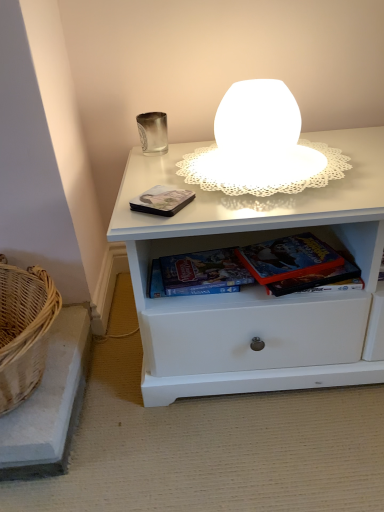
Question: Can you confirm if hardcover book at lower center, which ranks as the third paperback book in left-to-right order, is positioned to the right of white frosted glass table lamp at upper center?

Choices:
 (A) yes
 (B) no

Answer: (A)

Question: From the image's perspective, would you say hardcover book at lower center, acting as the 1th paperback book starting from the right, is positioned over white frosted glass table lamp at upper center?

Choices:
 (A) yes
 (B) no

Answer: (B)

Question: Is hardcover book at lower center, which ranks as the third paperback book in left-to-right order, facing towards white frosted glass table lamp at upper center?

Choices:
 (A) no
 (B) yes

Answer: (A)

Question: Is hardcover book at lower center, acting as the 1th paperback book starting from the right, bigger than white frosted glass table lamp at upper center?

Choices:
 (A) no
 (B) yes

Answer: (A)

Question: Considering the relative sizes of hardcover book at lower center, acting as the 1th paperback book starting from the right, and white frosted glass table lamp at upper center in the image provided, is hardcover book at lower center, acting as the 1th paperback book starting from the right, smaller than white frosted glass table lamp at upper center?

Choices:
 (A) no
 (B) yes

Answer: (B)

Question: Is point click(x=266, y=248) positioned closer to the camera than point click(x=157, y=186)?

Choices:
 (A) farther
 (B) closer

Answer: (A)

Question: From the image's perspective, is hardcover book at lower center, which ranks as the third paperback book in left-to-right order, positioned above or below metallic matte book at center, arranged as the first paperback book when viewed from the left?

Choices:
 (A) above
 (B) below

Answer: (B)

Question: Visually, is hardcover book at lower center, acting as the 1th paperback book starting from the right, positioned to the left or to the right of metallic matte book at center, the third paperback book in the right-to-left sequence?

Choices:
 (A) left
 (B) right

Answer: (B)

Question: Is hardcover book at lower center, which ranks as the third paperback book in left-to-right order, wider or thinner than metallic matte book at center, the third paperback book in the right-to-left sequence?

Choices:
 (A) wide
 (B) thin

Answer: (A)

Question: In the image, is hardcover book at lower center, which ranks as the third paperback book in left-to-right order, on the left side or the right side of woven wicker basket at lower left?

Choices:
 (A) right
 (B) left

Answer: (A)

Question: In terms of height, does hardcover book at lower center, acting as the 1th paperback book starting from the right, look taller or shorter compared to woven wicker basket at lower left?

Choices:
 (A) tall
 (B) short

Answer: (B)

Question: Considering the positions of point (324, 261) and point (67, 357), is point (324, 261) closer or farther from the camera than point (67, 357)?

Choices:
 (A) closer
 (B) farther

Answer: (A)

Question: From the image's perspective, relative to woven wicker basket at lower left, is hardcover book at lower center, acting as the 1th paperback book starting from the right, above or below?

Choices:
 (A) above
 (B) below

Answer: (A)

Question: Based on their sizes in the image, would you say white frosted glass table lamp at upper center is bigger or smaller than metallic matte book at center, arranged as the first paperback book when viewed from the left?

Choices:
 (A) small
 (B) big

Answer: (B)

Question: Considering the positions of white frosted glass table lamp at upper center and metallic matte book at center, arranged as the first paperback book when viewed from the left, in the image, is white frosted glass table lamp at upper center wider or thinner than metallic matte book at center, arranged as the first paperback book when viewed from the left,?

Choices:
 (A) thin
 (B) wide

Answer: (B)